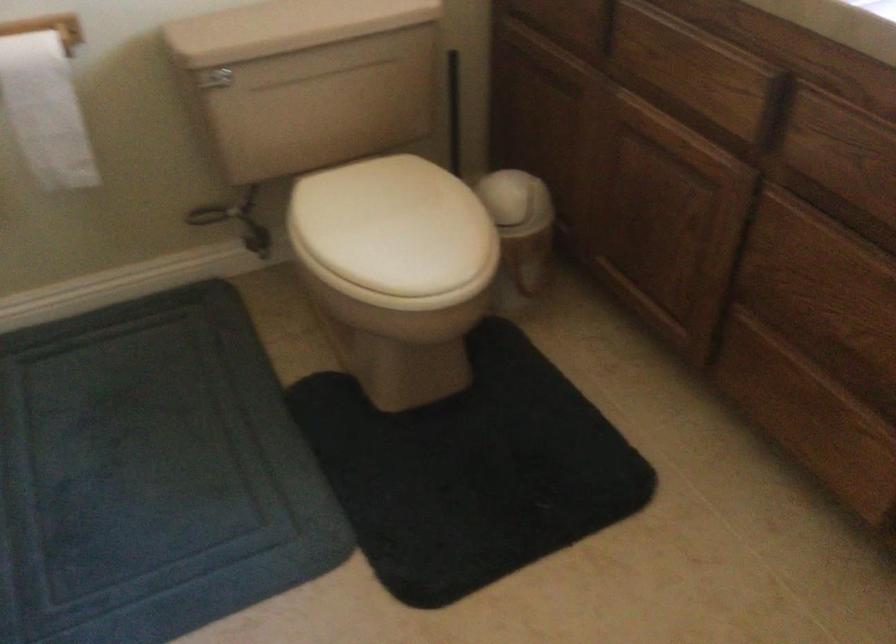
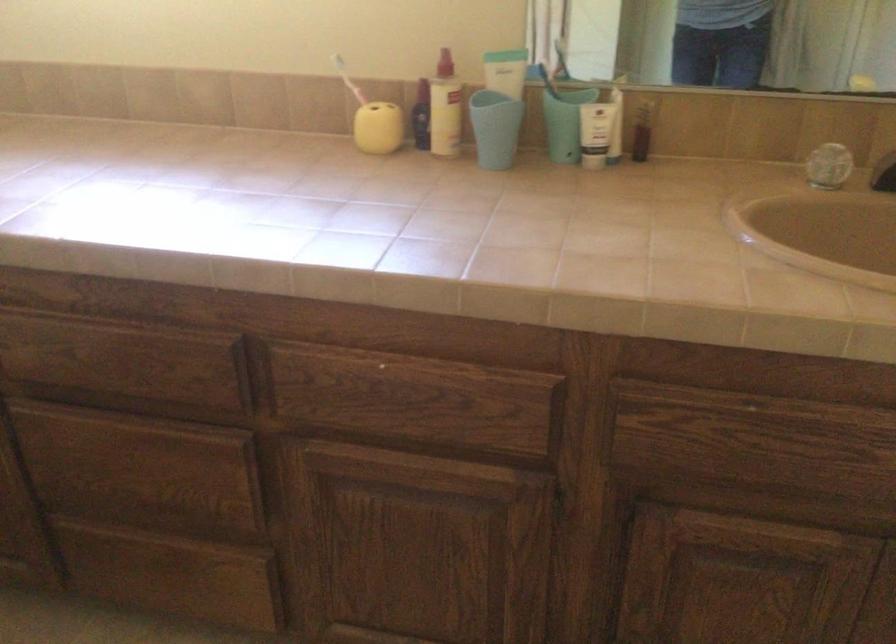
Question: The first image is from the beginning of the video and the second image is from the end. How did the camera likely rotate when shooting the video?

Choices:
 (A) Left
 (B) Right
 (C) Up
 (D) Down

Answer: (B)